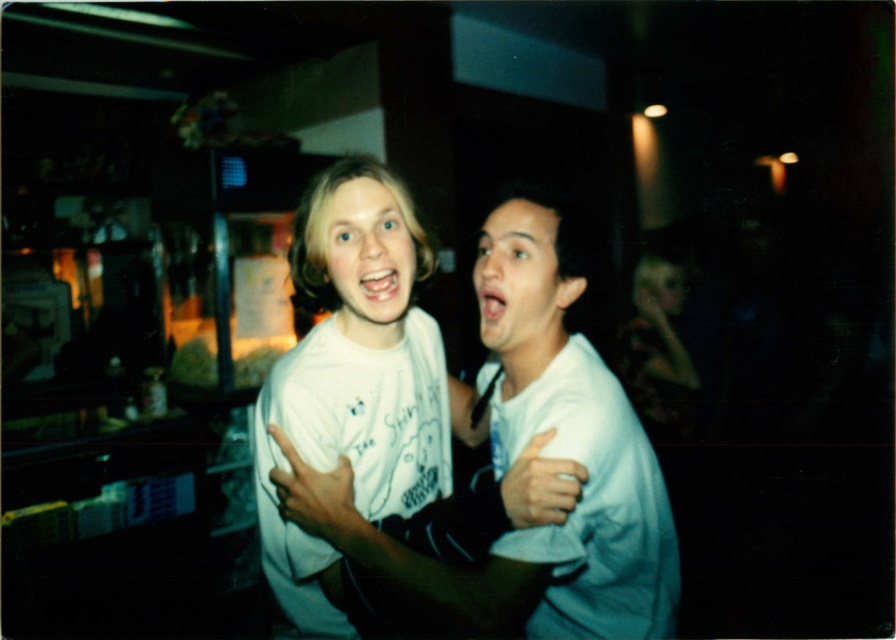
Is white cotton shirt at center smaller than white matte hand at center?

Incorrect, white cotton shirt at center is not smaller in size than white matte hand at center.

Does white cotton shirt at center appear on the left side of white matte hand at center?

Yes, white cotton shirt at center is to the left of white matte hand at center.

Is point (604, 620) more distant than point (532, 518)?

Yes, it is.

Locate an element on the screen. white cotton shirt at center is located at coordinates (515, 458).

Find the location of a particular element. The image size is (896, 640). white cotton shirt at center is located at coordinates (515, 458).

Is point (595, 396) behind point (291, 454)?

Yes, it is.

The height and width of the screenshot is (640, 896). What do you see at coordinates (515, 458) in the screenshot?
I see `white cotton shirt at center` at bounding box center [515, 458].

You are a GUI agent. You are given a task and a screenshot of the screen. Output one action in this format:
    pyautogui.click(x=<x>, y=<y>)
    Task: Click on the white cotton shirt at center
    The width and height of the screenshot is (896, 640).
    Given the screenshot: What is the action you would take?
    pyautogui.click(x=515, y=458)

Does white cotton shirt at center appear on the right side of white matte t-shirt at center?

Correct, you'll find white cotton shirt at center to the right of white matte t-shirt at center.

Who is positioned more to the right, white cotton shirt at center or white matte t-shirt at center?

white cotton shirt at center

Consider the image. Who is more forward, (630, 508) or (313, 225)?

Point (630, 508)

The height and width of the screenshot is (640, 896). In order to click on white cotton shirt at center in this screenshot , I will do `click(515, 458)`.